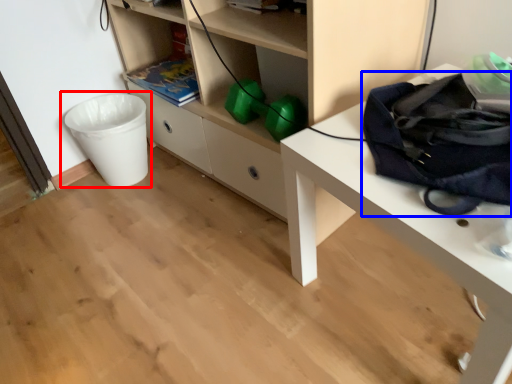
Question: Which object appears farthest to the camera in this image, waste container (highlighted by a red box) or messenger bag (highlighted by a blue box)?

Choices:
 (A) waste container
 (B) messenger bag

Answer: (A)